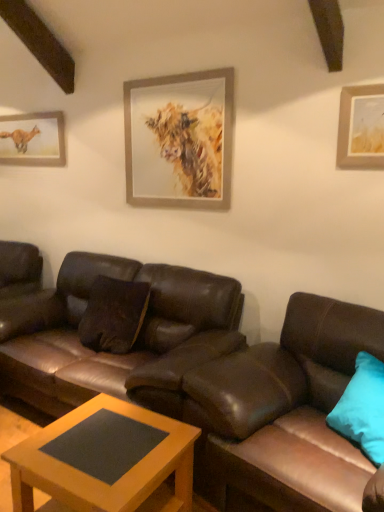
Question: Is wooden-framed painting of a cow at upper center, the first picture frame positioned from the right, taller than matte paper picture frame at upper left, acting as the second picture frame starting from the front?

Choices:
 (A) no
 (B) yes

Answer: (B)

Question: Does wooden-framed painting of a cow at upper center, the first picture frame positioned from the right, have a greater width compared to matte paper picture frame at upper left, which appears as the first picture frame when viewed from the left?

Choices:
 (A) no
 (B) yes

Answer: (B)

Question: Can matte paper picture frame at upper left, marked as the first picture frame in a back-to-front arrangement, be found inside wooden-framed painting of a cow at upper center, which is the 2th picture frame from left to right?

Choices:
 (A) no
 (B) yes

Answer: (A)

Question: Is wooden-framed painting of a cow at upper center, which is the 2th picture frame from back to front, smaller than matte paper picture frame at upper left, which appears as the first picture frame when viewed from the left?

Choices:
 (A) no
 (B) yes

Answer: (A)

Question: Can you confirm if wooden-framed painting of a cow at upper center, which is the 2th picture frame from left to right, is positioned to the left of matte paper picture frame at upper left, acting as the second picture frame starting from the front?

Choices:
 (A) no
 (B) yes

Answer: (A)

Question: Is wooden-framed painting of a cow at upper center, the first picture frame positioned from the right, at the right side of matte paper picture frame at upper left, which ranks as the 2th picture frame in right-to-left order?

Choices:
 (A) no
 (B) yes

Answer: (B)

Question: Does brown leather couch at center, which ranks as the second studio couch in right-to-left order, appear on the left side of teal fabric pillow at right?

Choices:
 (A) yes
 (B) no

Answer: (A)

Question: Considering the relative sizes of brown leather couch at center, which ranks as the second studio couch in right-to-left order, and teal fabric pillow at right in the image provided, is brown leather couch at center, which ranks as the second studio couch in right-to-left order, wider than teal fabric pillow at right?

Choices:
 (A) no
 (B) yes

Answer: (B)

Question: Is brown leather couch at center, which is the first studio couch from left to right, further to the viewer compared to teal fabric pillow at right?

Choices:
 (A) yes
 (B) no

Answer: (A)

Question: From a real-world perspective, is brown leather couch at center, which ranks as the second studio couch in right-to-left order, under teal fabric pillow at right?

Choices:
 (A) no
 (B) yes

Answer: (B)

Question: Is brown leather couch at center, which ranks as the second studio couch in right-to-left order, not inside teal fabric pillow at right?

Choices:
 (A) yes
 (B) no

Answer: (A)

Question: Does brown leather couch at center, which ranks as the second studio couch in right-to-left order, turn towards teal fabric pillow at right?

Choices:
 (A) no
 (B) yes

Answer: (A)

Question: Considering the relative positions of matte paper picture frame at upper left, which appears as the first picture frame when viewed from the left, and teal fabric pillow at right in the image provided, is matte paper picture frame at upper left, which appears as the first picture frame when viewed from the left, in front of teal fabric pillow at right?

Choices:
 (A) yes
 (B) no

Answer: (B)